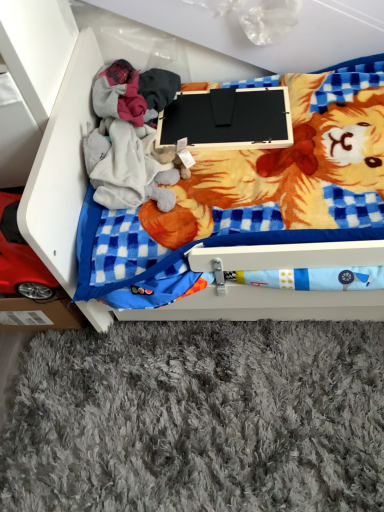
Identify the location of blank space situated above black matte laptop at center (from a real-world perspective). The image size is (384, 512). (211, 110).